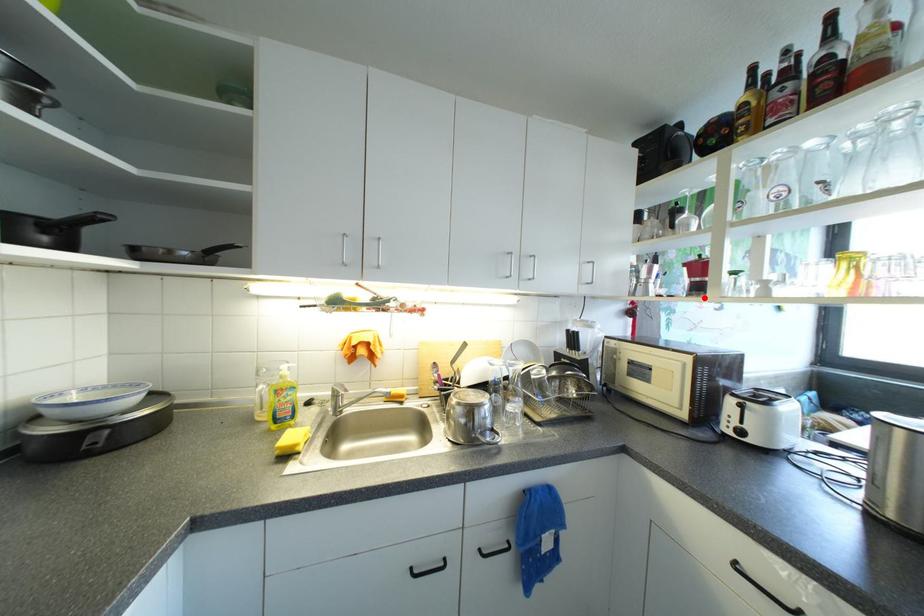
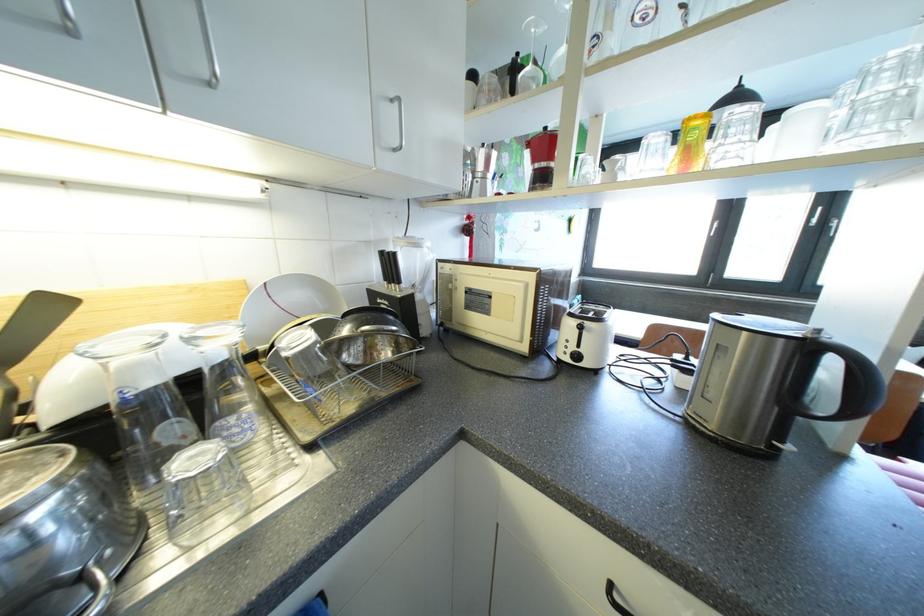
Find the pixel in the second image that matches the highlighted location in the first image.

(549, 192)